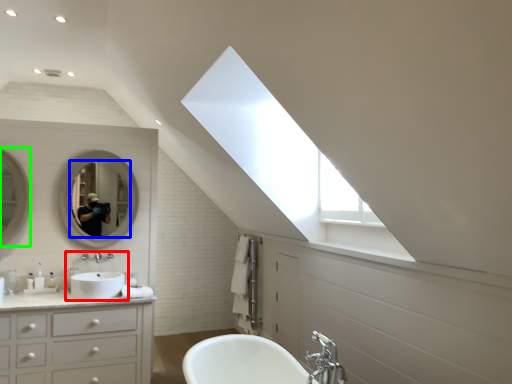
Question: Estimate the real-world distances between objects in this image. Which object is closer to sink (highlighted by a red box), mirror (highlighted by a blue box) or mirror (highlighted by a green box)?

Choices:
 (A) mirror
 (B) mirror

Answer: (A)